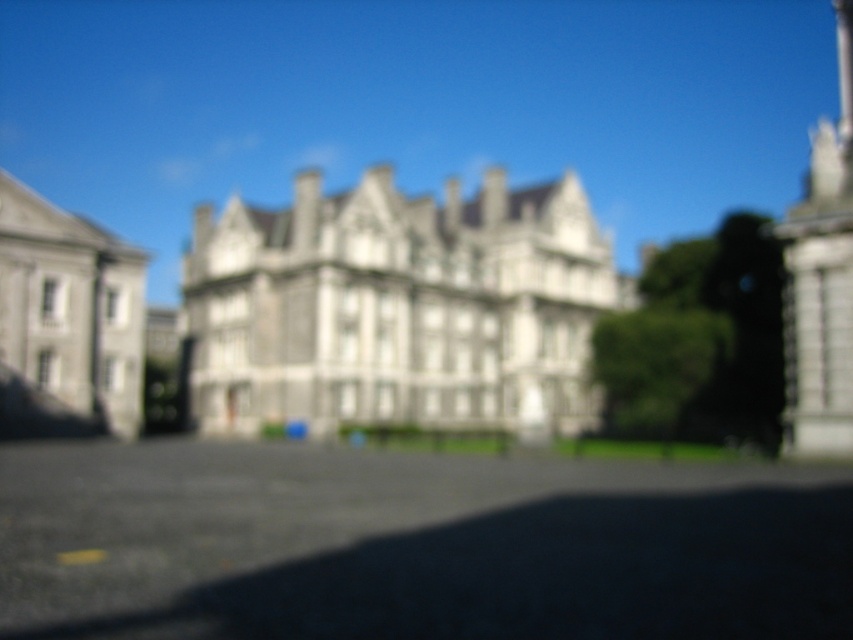
You are standing in front of the historic building and want to take a photo. You notice two points marked on the ground at coordinates point (596, 396) and point (47, 362). Which point is closer to your camera position?

Point (596, 396) is further to the camera than point (47, 362), so the point closer to your camera position is point (47, 362).

You are standing in the courtyard in front of the white stone building at center. If you walk directly towards the building, will you first encounter the paved area or the building itself?

The white stone building at center is located at point (399, 308), meaning it is positioned centrally in the image. Since you are in the courtyard in front of it, walking directly towards the building would first encounter the paved area before reaching the building itself.